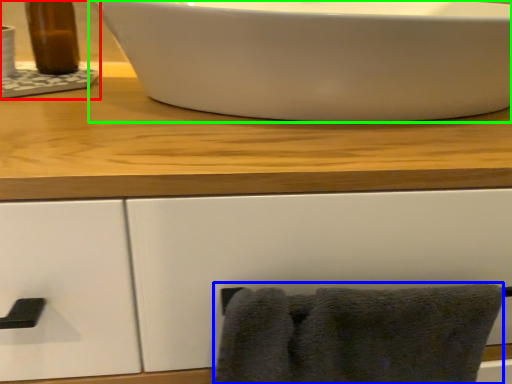
Question: Considering the real-world distances, which object is closest to sink (highlighted by a red box)? bath towel (highlighted by a blue box) or sink (highlighted by a green box).

Choices:
 (A) bath towel
 (B) sink

Answer: (B)